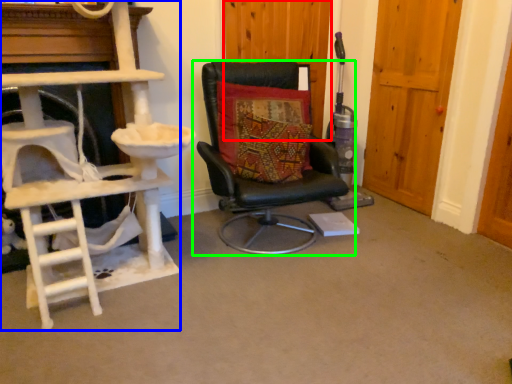
Question: Which is nearer to the door (highlighted by a red box)? ladder (highlighted by a blue box) or chair (highlighted by a green box).

Choices:
 (A) ladder
 (B) chair

Answer: (B)